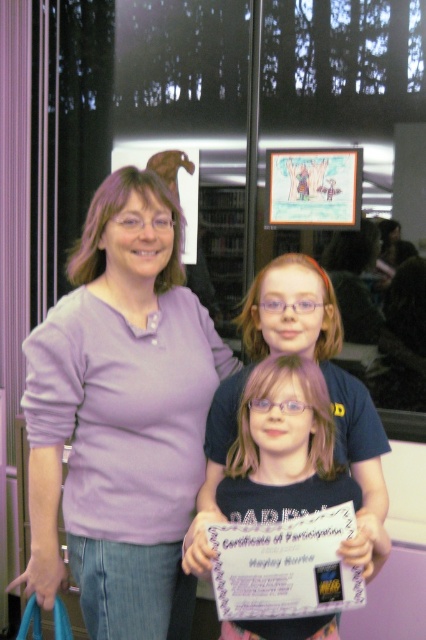
Is purple cotton shirt at center smaller than matte black shirt at center?

Actually, purple cotton shirt at center might be larger than matte black shirt at center.

Describe the element at coordinates (120, 417) in the screenshot. I see `purple cotton shirt at center` at that location.

Image resolution: width=426 pixels, height=640 pixels. I want to click on purple cotton shirt at center, so click(x=120, y=417).

The height and width of the screenshot is (640, 426). Find the location of `purple cotton shirt at center`. purple cotton shirt at center is located at coordinates (120, 417).